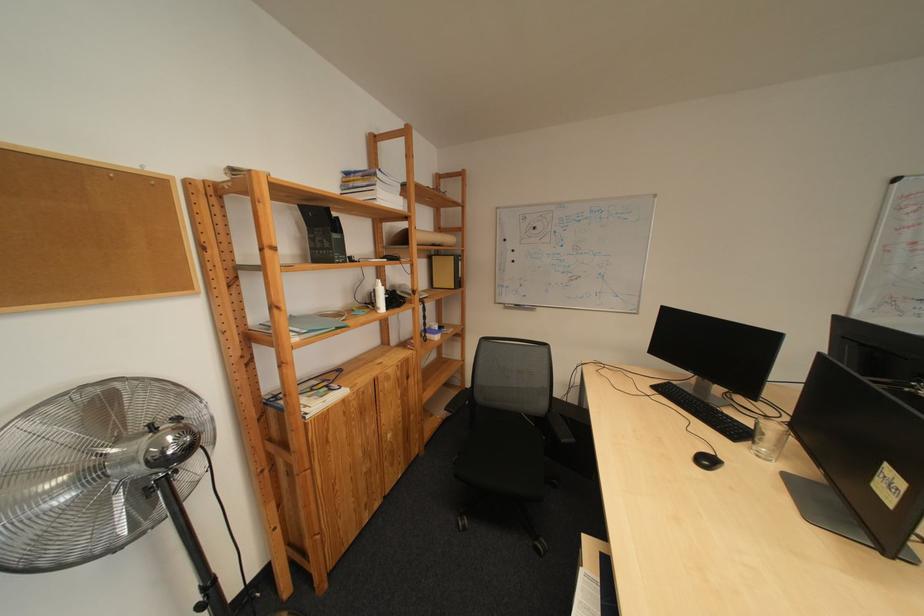
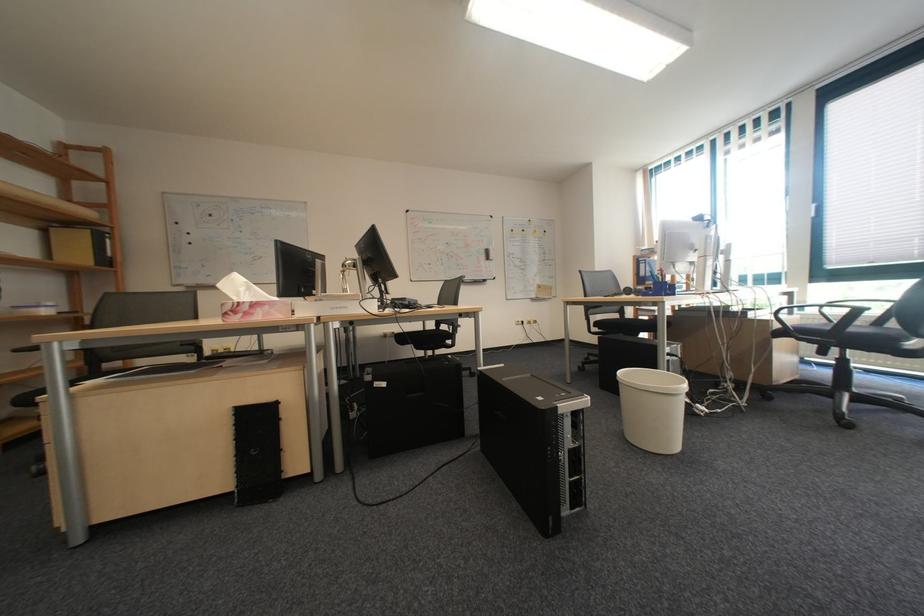
Locate, in the second image, the point that corresponds to pixel 593 278 in the first image.

(275, 257)